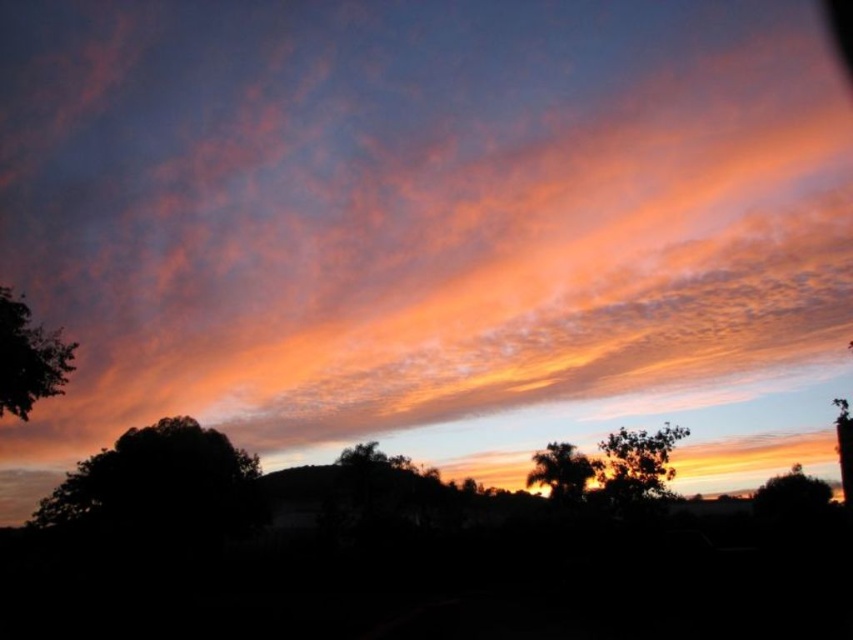
Is cloudy sky at upper center to the right of green leafy tree at center from the viewer's perspective?

In fact, cloudy sky at upper center is to the left of green leafy tree at center.

From the picture: Can you confirm if cloudy sky at upper center is positioned to the left of green leafy tree at center?

Correct, you'll find cloudy sky at upper center to the left of green leafy tree at center.

Is point (268, 80) more distant than point (666, 493)?

Yes, point (268, 80) is behind point (666, 493).

Where is `cloudy sky at upper center`? This screenshot has width=853, height=640. cloudy sky at upper center is located at coordinates (419, 212).

Is point (810, 236) more distant than point (577, 460)?

Yes, point (810, 236) is behind point (577, 460).

Is cloudy sky at upper center above silhouetted tree at center?

Yes, cloudy sky at upper center is above silhouetted tree at center.

Measure the distance between cloudy sky at upper center and camera.

cloudy sky at upper center is 37.30 meters away from camera.

Locate an element on the screen. cloudy sky at upper center is located at coordinates (419, 212).

Is silhouette tree at left in front of green leafy tree at lower right?

No, silhouette tree at left is further to the viewer.

Can you confirm if silhouette tree at left is wider than green leafy tree at lower right?

In fact, silhouette tree at left might be narrower than green leafy tree at lower right.

Between point (67, 480) and point (785, 476), which one is positioned in front?

Point (67, 480)

You are a GUI agent. You are given a task and a screenshot of the screen. Output one action in this format:
    pyautogui.click(x=<x>, y=<y>)
    Task: Click on the silhouette tree at left
    
    Given the screenshot: What is the action you would take?
    pyautogui.click(x=161, y=483)